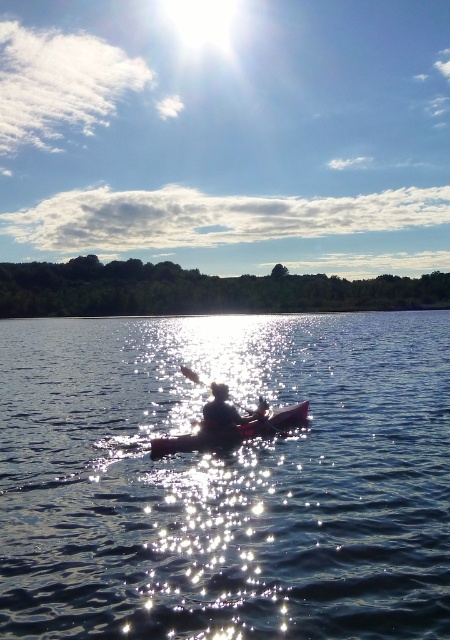
Question: Which is nearer to the silhouette fabric person at center?

Choices:
 (A) glistening water at center
 (B) pink plastic kayak at center
 (C) wooden paddle at center

Answer: (C)

Question: Is wooden paddle at center further to camera compared to silhouette fabric person at center?

Choices:
 (A) yes
 (B) no

Answer: (A)

Question: Is glistening water at center thinner than silhouette fabric person at center?

Choices:
 (A) yes
 (B) no

Answer: (B)

Question: Does pink plastic kayak at center have a greater width compared to silhouette fabric person at center?

Choices:
 (A) no
 (B) yes

Answer: (B)

Question: Which of the following is the farthest from the observer?

Choices:
 (A) glistening water at center
 (B) pink plastic kayak at center
 (C) silhouette fabric person at center
 (D) wooden paddle at center

Answer: (D)

Question: Which point is farther to the camera?

Choices:
 (A) pink plastic kayak at center
 (B) glistening water at center
 (C) silhouette fabric person at center

Answer: (C)